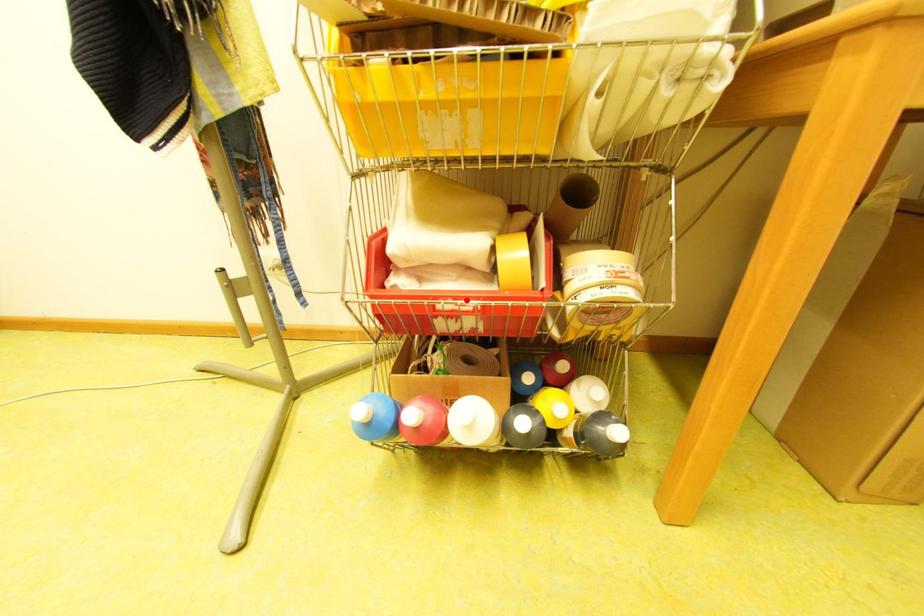
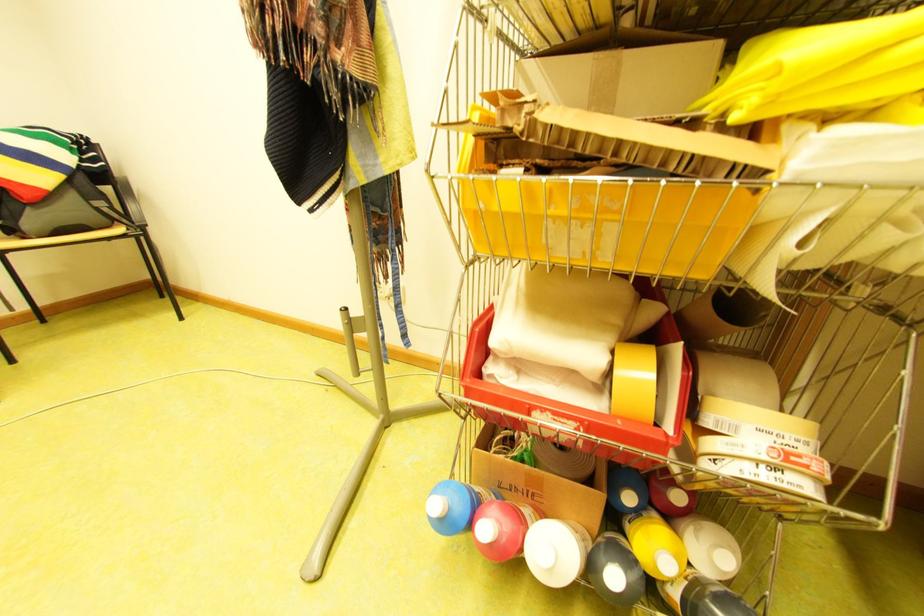
Locate, in the second image, the point that corresponds to the highlighted location in the first image.

(565, 414)